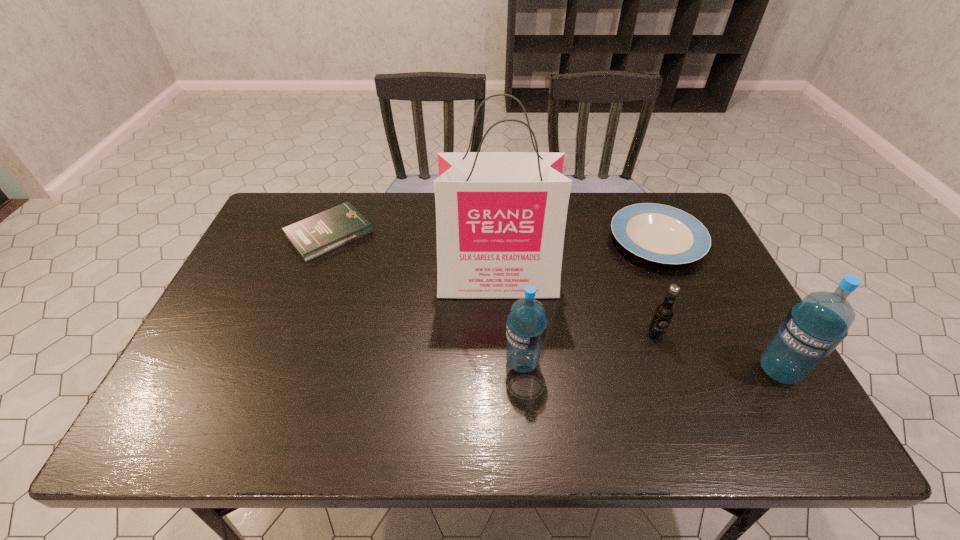
This screenshot has width=960, height=540. I want to click on plate located at the right edge, so click(659, 233).

You are a GUI agent. You are given a task and a screenshot of the screen. Output one action in this format:
    pyautogui.click(x=<x>, y=<y>)
    Task: Click on the object present at the far left corner
    Image resolution: width=960 pixels, height=540 pixels.
    Given the screenshot: What is the action you would take?
    314,236

Locate an element on the screen. The width and height of the screenshot is (960, 540). object present at the far right corner is located at coordinates (659, 233).

Locate an element on the screen. object positioned at the near right corner is located at coordinates (813, 328).

Find the location of a particular element. vacant space at the far edge is located at coordinates (576, 219).

In the image, there is a desktop. Identify the location of free space at the near edge. (573, 388).

Where is `vacant region at the left edge of the desktop`? vacant region at the left edge of the desktop is located at coordinates (275, 314).

I want to click on free space at the right edge of the desktop, so click(742, 341).

This screenshot has height=540, width=960. I want to click on vacant space at the far left corner of the desktop, so click(273, 228).

Locate an element on the screen. blank area at the near left corner is located at coordinates (195, 386).